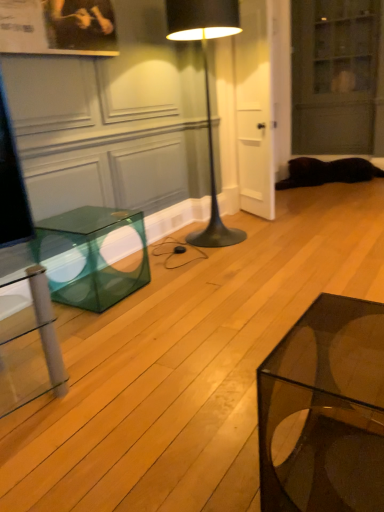
Question: Is transparent glass cube at left positioned far away from transparent glass cabinet at upper right?

Choices:
 (A) yes
 (B) no

Answer: (A)

Question: Is transparent glass cube at left in front of transparent glass cabinet at upper right?

Choices:
 (A) yes
 (B) no

Answer: (A)

Question: Would you say transparent glass cube at left contains transparent glass cabinet at upper right?

Choices:
 (A) no
 (B) yes

Answer: (A)

Question: Considering the relative sizes of transparent glass cube at left and transparent glass cabinet at upper right in the image provided, is transparent glass cube at left smaller than transparent glass cabinet at upper right?

Choices:
 (A) no
 (B) yes

Answer: (B)

Question: From a real-world perspective, is transparent glass cube at left below transparent glass cabinet at upper right?

Choices:
 (A) no
 (B) yes

Answer: (B)

Question: From the image's perspective, would you say transparent glass cube at left is positioned over transparent glass cabinet at upper right?

Choices:
 (A) no
 (B) yes

Answer: (A)

Question: Is transparent glass cube at left behind black fur cat at lower right?

Choices:
 (A) yes
 (B) no

Answer: (B)

Question: From the image's perspective, is transparent glass cube at left beneath black fur cat at lower right?

Choices:
 (A) yes
 (B) no

Answer: (A)

Question: Can you confirm if transparent glass cube at left is wider than black fur cat at lower right?

Choices:
 (A) yes
 (B) no

Answer: (B)

Question: Does transparent glass cube at left have a larger size compared to black fur cat at lower right?

Choices:
 (A) no
 (B) yes

Answer: (A)

Question: Can you confirm if transparent glass cube at left is taller than black fur cat at lower right?

Choices:
 (A) no
 (B) yes

Answer: (B)

Question: Considering the relative sizes of transparent glass cube at left and black fur cat at lower right in the image provided, is transparent glass cube at left smaller than black fur cat at lower right?

Choices:
 (A) no
 (B) yes

Answer: (B)

Question: From a real-world perspective, is black metal floor lamp at center below transparent glass cabinet at upper right?

Choices:
 (A) no
 (B) yes

Answer: (B)